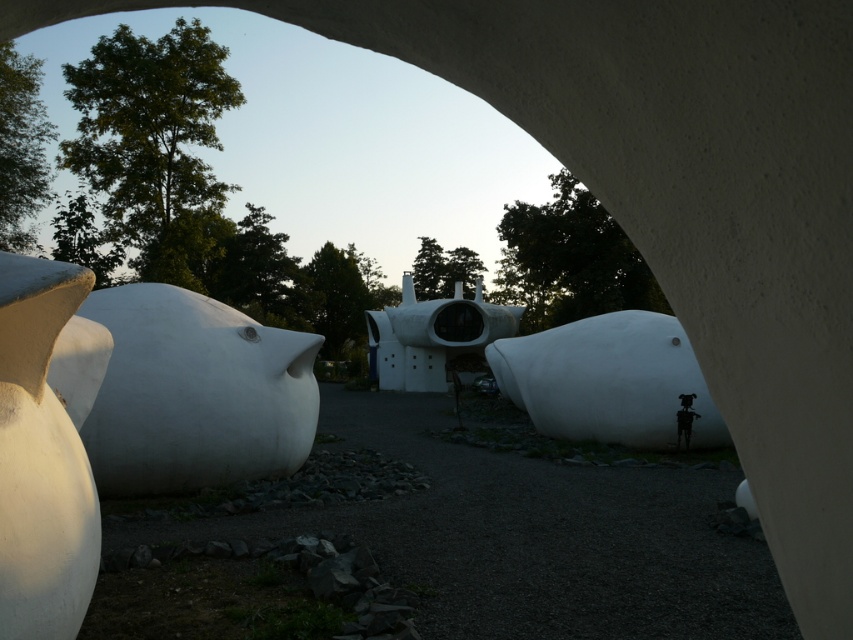
Question: Which object is positioned closest to the white matte fish at left?

Choices:
 (A) white matte sculpture at center
 (B) white matte sculpture at left
 (C) white matte airplane at center

Answer: (B)

Question: Does white matte sculpture at center have a larger size compared to white matte airplane at center?

Choices:
 (A) yes
 (B) no

Answer: (B)

Question: Does white matte sculpture at left have a smaller size compared to white matte airplane at center?

Choices:
 (A) no
 (B) yes

Answer: (B)

Question: Estimate the real-world distances between objects in this image. Which object is closer to the white matte fish at left?

Choices:
 (A) white matte sculpture at center
 (B) white matte sculpture at left

Answer: (B)

Question: Estimate the real-world distances between objects in this image. Which object is farther from the white matte airplane at center?

Choices:
 (A) white matte sculpture at center
 (B) white matte fish at left
 (C) white matte sculpture at left

Answer: (C)

Question: Observing the image, what is the correct spatial positioning of white matte sculpture at left in reference to white matte sculpture at center?

Choices:
 (A) right
 (B) left

Answer: (B)